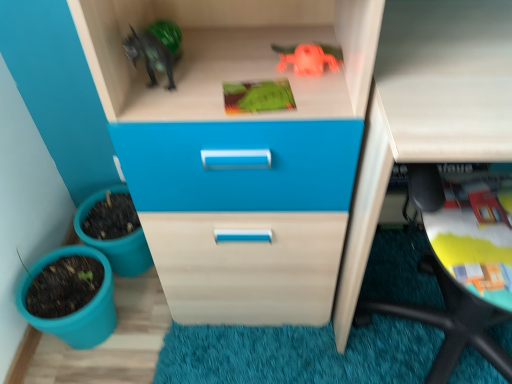
What do you see at coordinates (308, 58) in the screenshot?
I see `rubber orange toy at upper center, the 1th toy positioned from the top` at bounding box center [308, 58].

I want to click on teal plastic flowerpot at lower left, the second flowerpot when ordered from bottom to top, so click(x=116, y=243).

Describe the element at coordinates (258, 96) in the screenshot. I see `green matte toy at upper center, positioned as the first toy in bottom-to-top order` at that location.

I want to click on rubber orange toy at upper center, positioned as the second toy in bottom-to-top order, so click(308, 58).

From a real-world perspective, is rubber orange toy at upper center, positioned as the second toy in bottom-to-top order, physically located above or below green matte toy at upper center, positioned as the first toy in bottom-to-top order?

In terms of real-world spatial position, rubber orange toy at upper center, positioned as the second toy in bottom-to-top order, is above green matte toy at upper center, positioned as the first toy in bottom-to-top order.

Would you consider rubber orange toy at upper center, the 1th toy positioned from the top, to be distant from green matte toy at upper center, positioned as the first toy in bottom-to-top order?

Actually, rubber orange toy at upper center, the 1th toy positioned from the top, and green matte toy at upper center, positioned as the first toy in bottom-to-top order, are a little close together.

Considering the relative sizes of rubber orange toy at upper center, the 1th toy positioned from the top, and green matte toy at upper center, the 2th toy viewed from the top, in the image provided, is rubber orange toy at upper center, the 1th toy positioned from the top, taller than green matte toy at upper center, the 2th toy viewed from the top,?

Yes.

Which object is positioned more to the right, rubber orange toy at upper center, positioned as the second toy in bottom-to-top order, or green matte toy at upper center, the 2th toy viewed from the top?

Positioned to the right is rubber orange toy at upper center, positioned as the second toy in bottom-to-top order.

This screenshot has width=512, height=384. There is a green matte toy at upper center, the 2th toy viewed from the top. Find the location of `the 2nd flowerpot below it (from the image's perspective)`. the 2nd flowerpot below it (from the image's perspective) is located at coordinates (76, 311).

Does matte plastic flowerpot at lower left, which is the 2th flowerpot from top to bottom, turn towards green matte toy at upper center, positioned as the first toy in bottom-to-top order?

No, matte plastic flowerpot at lower left, which is the 2th flowerpot from top to bottom, is not oriented towards green matte toy at upper center, positioned as the first toy in bottom-to-top order.

From the picture: Based on their sizes in the image, would you say matte plastic flowerpot at lower left, which is the 2th flowerpot from top to bottom, is bigger or smaller than green matte toy at upper center, the 2th toy viewed from the top?

Clearly, matte plastic flowerpot at lower left, which is the 2th flowerpot from top to bottom, is larger in size than green matte toy at upper center, the 2th toy viewed from the top.

Does matte white computer desk at lower right have a larger size compared to green matte toy at upper center, positioned as the first toy in bottom-to-top order?

Indeed, matte white computer desk at lower right has a larger size compared to green matte toy at upper center, positioned as the first toy in bottom-to-top order.

Is there a large distance between matte white computer desk at lower right and green matte toy at upper center, positioned as the first toy in bottom-to-top order?

matte white computer desk at lower right is near green matte toy at upper center, positioned as the first toy in bottom-to-top order, not far away.

Could you tell me if matte white computer desk at lower right is facing green matte toy at upper center, the 2th toy viewed from the top?

No.

Is matte white computer desk at lower right situated inside green matte toy at upper center, positioned as the first toy in bottom-to-top order, or outside?

matte white computer desk at lower right is outside green matte toy at upper center, positioned as the first toy in bottom-to-top order.

Is matte white computer desk at lower right inside the boundaries of matte plastic flowerpot at lower left, which is the 2th flowerpot from top to bottom, or outside?

matte white computer desk at lower right is located beyond the bounds of matte plastic flowerpot at lower left, which is the 2th flowerpot from top to bottom.

Consider the image. Considering the relative sizes of matte white computer desk at lower right and matte plastic flowerpot at lower left, which is the 1th flowerpot in bottom-to-top order, in the image provided, is matte white computer desk at lower right taller than matte plastic flowerpot at lower left, which is the 1th flowerpot in bottom-to-top order,?

Yes, matte white computer desk at lower right is taller than matte plastic flowerpot at lower left, which is the 1th flowerpot in bottom-to-top order.

From a real-world perspective, who is located higher, matte white computer desk at lower right or matte plastic flowerpot at lower left, which is the 1th flowerpot in bottom-to-top order?

matte white computer desk at lower right is physically above.

Is matte white computer desk at lower right in front of or behind matte plastic flowerpot at lower left, which is the 1th flowerpot in bottom-to-top order, in the image?

Clearly, matte white computer desk at lower right is in front of matte plastic flowerpot at lower left, which is the 1th flowerpot in bottom-to-top order.

Is green matte toy at upper center, positioned as the first toy in bottom-to-top order, not inside matte plastic flowerpot at lower left, which is the 2th flowerpot from top to bottom?

Yes, green matte toy at upper center, positioned as the first toy in bottom-to-top order, is not within matte plastic flowerpot at lower left, which is the 2th flowerpot from top to bottom.

Is green matte toy at upper center, positioned as the first toy in bottom-to-top order, looking in the opposite direction of matte plastic flowerpot at lower left, which is the 1th flowerpot in bottom-to-top order?

No, green matte toy at upper center, positioned as the first toy in bottom-to-top order, is not facing the opposite direction of matte plastic flowerpot at lower left, which is the 1th flowerpot in bottom-to-top order.

Is green matte toy at upper center, positioned as the first toy in bottom-to-top order, to the right of matte plastic flowerpot at lower left, which is the 1th flowerpot in bottom-to-top order, from the viewer's perspective?

Correct, you'll find green matte toy at upper center, positioned as the first toy in bottom-to-top order, to the right of matte plastic flowerpot at lower left, which is the 1th flowerpot in bottom-to-top order.

Is green matte toy at upper center, positioned as the first toy in bottom-to-top order, in front of or behind matte plastic flowerpot at lower left, which is the 2th flowerpot from top to bottom, in the image?

In the image, green matte toy at upper center, positioned as the first toy in bottom-to-top order, appears in front of matte plastic flowerpot at lower left, which is the 2th flowerpot from top to bottom.

This screenshot has height=384, width=512. In order to click on toy that is the 2nd object above the matte plastic flowerpot at lower left, which is the 2th flowerpot from top to bottom (from a real-world perspective) in this screenshot , I will do `click(308, 58)`.

Which object is positioned more to the left, matte plastic flowerpot at lower left, which is the 2th flowerpot from top to bottom, or rubber orange toy at upper center, the 1th toy positioned from the top?

From the viewer's perspective, matte plastic flowerpot at lower left, which is the 2th flowerpot from top to bottom, appears more on the left side.

Considering the sizes of objects rubber orange toy at upper center, the 1th toy positioned from the top, and matte white computer desk at lower right in the image provided, who is taller, rubber orange toy at upper center, the 1th toy positioned from the top, or matte white computer desk at lower right?

matte white computer desk at lower right.

In the scene shown: From a real-world perspective, between rubber orange toy at upper center, positioned as the second toy in bottom-to-top order, and matte white computer desk at lower right, who is vertically higher?

In real-world perspective, rubber orange toy at upper center, positioned as the second toy in bottom-to-top order, is above.

Is rubber orange toy at upper center, positioned as the second toy in bottom-to-top order, behind matte white computer desk at lower right?

Yes.

Locate an element on the screen. This screenshot has width=512, height=384. toy on the right side of green matte toy at upper center, the 2th toy viewed from the top is located at coordinates (308, 58).

There is a green matte toy at upper center, positioned as the first toy in bottom-to-top order. Where is `the 2nd flowerpot below it (from the image's perspective)`? Image resolution: width=512 pixels, height=384 pixels. the 2nd flowerpot below it (from the image's perspective) is located at coordinates (76, 311).

From the image, which object appears to be farther from rubber orange toy at upper center, the 1th toy positioned from the top, green matte toy at upper center, positioned as the first toy in bottom-to-top order, or teal plastic flowerpot at lower left, the second flowerpot when ordered from bottom to top?

teal plastic flowerpot at lower left, the second flowerpot when ordered from bottom to top, lies further to rubber orange toy at upper center, the 1th toy positioned from the top, than the other object.

Considering their positions, is rubber orange toy at upper center, positioned as the second toy in bottom-to-top order, positioned closer to teal plastic flowerpot at lower left, which is the 1th flowerpot in top-to-bottom order, than green matte toy at upper center, the 2th toy viewed from the top?

green matte toy at upper center, the 2th toy viewed from the top.

Based on their spatial positions, is green matte toy at upper center, the 2th toy viewed from the top, or matte white computer desk at lower right further from rubber orange toy at upper center, positioned as the second toy in bottom-to-top order?

Among the two, matte white computer desk at lower right is located further to rubber orange toy at upper center, positioned as the second toy in bottom-to-top order.

In the scene shown: When comparing their distances from rubber orange toy at upper center, the 1th toy positioned from the top, does teal plastic flowerpot at lower left, the second flowerpot when ordered from bottom to top, or matte plastic flowerpot at lower left, which is the 2th flowerpot from top to bottom, seem further?

Among the two, matte plastic flowerpot at lower left, which is the 2th flowerpot from top to bottom, is located further to rubber orange toy at upper center, the 1th toy positioned from the top.

Which object lies further to the anchor point green matte toy at upper center, positioned as the first toy in bottom-to-top order, matte plastic flowerpot at lower left, which is the 1th flowerpot in bottom-to-top order, or rubber orange toy at upper center, the 1th toy positioned from the top?

matte plastic flowerpot at lower left, which is the 1th flowerpot in bottom-to-top order, is positioned further to the anchor green matte toy at upper center, positioned as the first toy in bottom-to-top order.

From the image, which object appears to be farther from matte white computer desk at lower right, teal plastic flowerpot at lower left, which is the 1th flowerpot in top-to-bottom order, or rubber orange toy at upper center, positioned as the second toy in bottom-to-top order?

teal plastic flowerpot at lower left, which is the 1th flowerpot in top-to-bottom order, lies further to matte white computer desk at lower right than the other object.

Estimate the real-world distances between objects in this image. Which object is closer to matte plastic flowerpot at lower left, which is the 2th flowerpot from top to bottom, matte white computer desk at lower right or teal plastic flowerpot at lower left, which is the 1th flowerpot in top-to-bottom order?

Based on the image, teal plastic flowerpot at lower left, which is the 1th flowerpot in top-to-bottom order, appears to be nearer to matte plastic flowerpot at lower left, which is the 2th flowerpot from top to bottom.

Looking at the image, which one is located closer to teal plastic flowerpot at lower left, the second flowerpot when ordered from bottom to top, matte plastic flowerpot at lower left, which is the 2th flowerpot from top to bottom, or green matte toy at upper center, the 2th toy viewed from the top?

Among the two, matte plastic flowerpot at lower left, which is the 2th flowerpot from top to bottom, is located nearer to teal plastic flowerpot at lower left, the second flowerpot when ordered from bottom to top.

Locate an element on the screen. Image resolution: width=512 pixels, height=384 pixels. toy between matte plastic flowerpot at lower left, which is the 1th flowerpot in bottom-to-top order, and rubber orange toy at upper center, the 1th toy positioned from the top, from left to right is located at coordinates (258, 96).

Where is `toy located between teal plastic flowerpot at lower left, the second flowerpot when ordered from bottom to top, and rubber orange toy at upper center, the 1th toy positioned from the top, in the left-right direction`? toy located between teal plastic flowerpot at lower left, the second flowerpot when ordered from bottom to top, and rubber orange toy at upper center, the 1th toy positioned from the top, in the left-right direction is located at coordinates (258, 96).

Identify the location of flowerpot between matte plastic flowerpot at lower left, which is the 1th flowerpot in bottom-to-top order, and green matte toy at upper center, positioned as the first toy in bottom-to-top order, in the horizontal direction. (116, 243).

Find the location of a particular element. This screenshot has height=384, width=512. flowerpot between matte plastic flowerpot at lower left, which is the 1th flowerpot in bottom-to-top order, and rubber orange toy at upper center, the 1th toy positioned from the top is located at coordinates (116, 243).